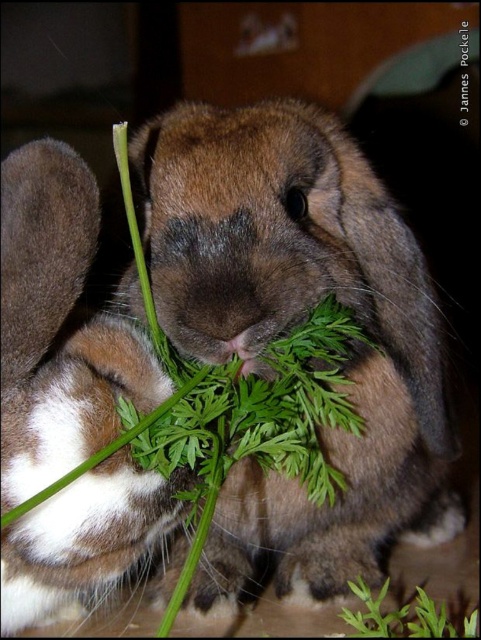
You are a photographer trying to capture a closeup of the green leafy plant at lower right without the brown fur rabbit at left blocking the view. Based on their sizes, do you think you can position yourself so that the rabbit is entirely out of the frame while keeping the plant centered?

The brown fur rabbit at left is larger in size than the green leafy plant at lower right. Since the rabbit is bigger, you might need to adjust your position carefully to ensure the rabbit doesn

Based on the photo, you are a photographer trying to capture a picture of the brown fur rabbit at center and the green leafy plant at lower right. Based on their positions, which object should you adjust your camera focus to first if you want to ensure both are in focus?

The brown fur rabbit at center is to the left of green leafy plant at lower right, so you should focus on the brown fur rabbit at center first since it is closer to the camera.

Consider the image. There are two rabbits in the scene. The brown fur rabbit at center is eating leafy greens. The other rabbit is partially visible on the left. How far apart are the two rabbits?

The two rabbits are 28.63 inches apart.